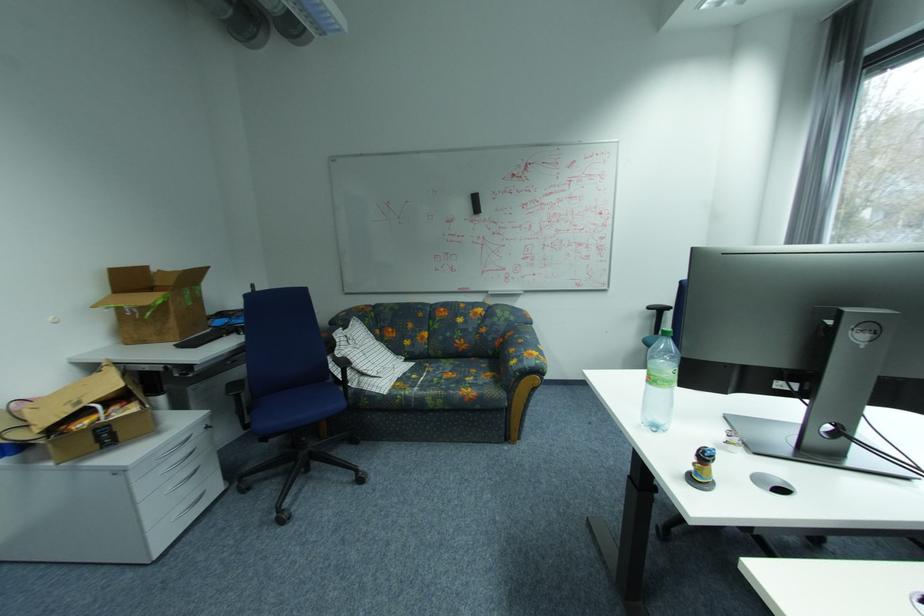
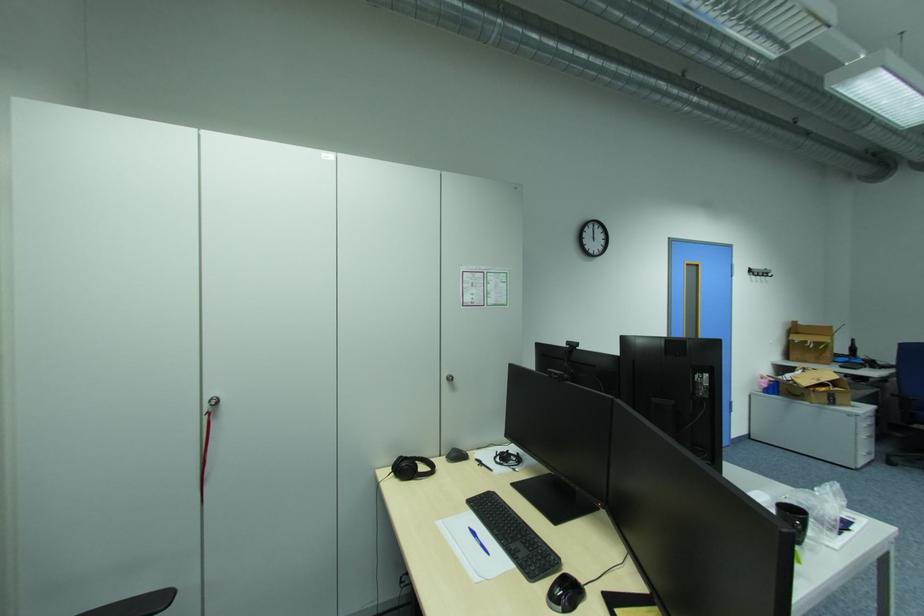
In the second image, find the point that corresponds to [162,270] in the first image.

(808, 323)